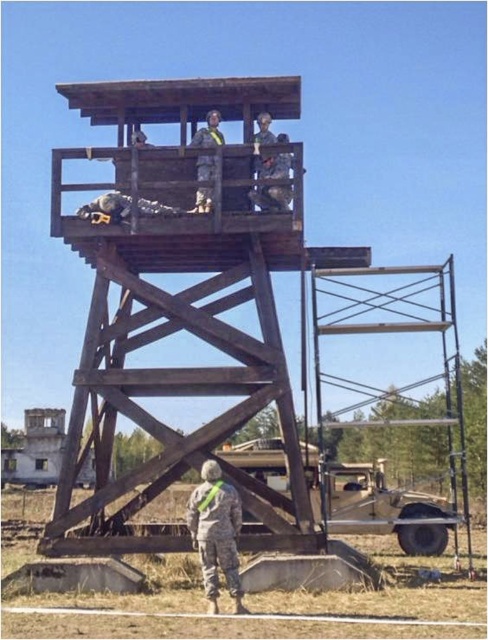
Question: Which object is closer to the camera taking this photo?

Choices:
 (A) camouflage fabric uniform at lower center
 (B) camouflage fabric uniform at center

Answer: (A)

Question: Which of the following is the closest to the observer?

Choices:
 (A) (216, 536)
 (B) (210, 131)

Answer: (A)

Question: Can you confirm if camouflage fabric uniform at lower center is wider than camouflage fabric uniform at center?

Choices:
 (A) no
 (B) yes

Answer: (B)

Question: Can you confirm if camouflage fabric uniform at lower center is bigger than camouflage fabric uniform at center?

Choices:
 (A) no
 (B) yes

Answer: (B)

Question: Can you confirm if camouflage fabric uniform at lower center is bigger than camouflage fabric uniform at center?

Choices:
 (A) no
 (B) yes

Answer: (B)